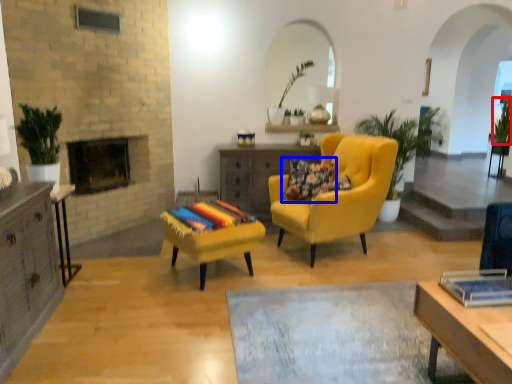
Question: Which object appears closest to the camera in this image, plant (highlighted by a red box) or pillow (highlighted by a blue box)?

Choices:
 (A) plant
 (B) pillow

Answer: (B)